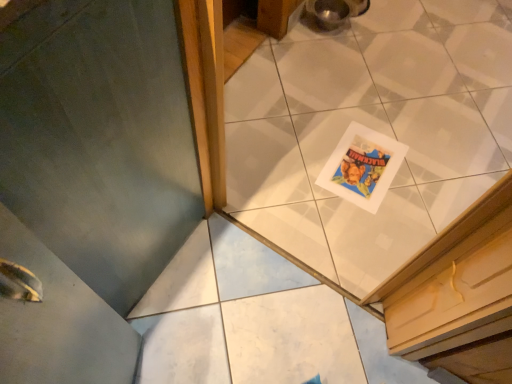
Question: Should I look upward or downward to see white glossy tile at center?

Choices:
 (A) down
 (B) up

Answer: (A)